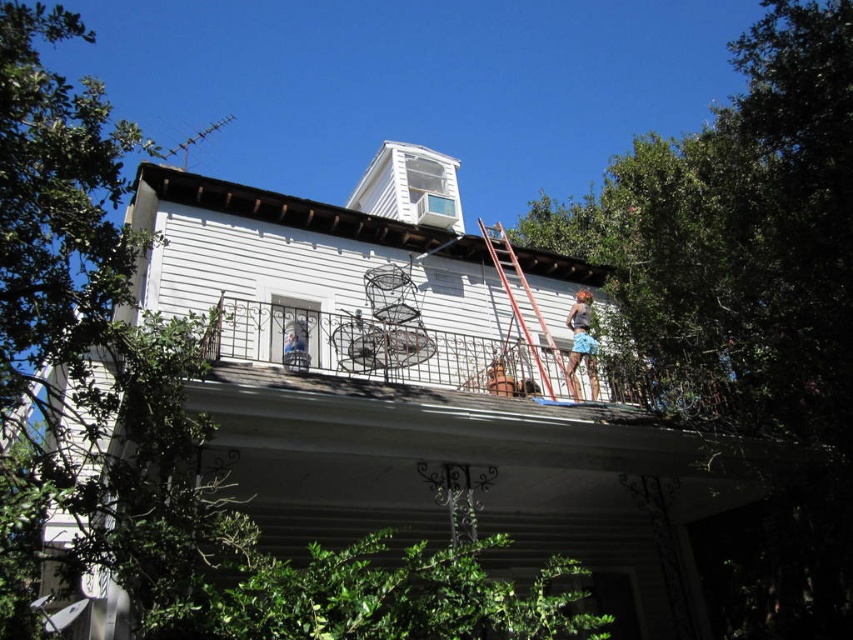
You are standing at the base of the rustic wood ladder at upper center, and you want to walk to the camera. How many steps would you need to take to reach the camera if each step covers 2.5 feet?

The distance between rustic wood ladder at upper center and the camera is 55.96 feet. Dividing this by 2.5 feet per step gives approximately 22.38 steps. Since you can only take whole steps, you would need to take 23 steps to reach the camera.

You are standing at the camera position and want to reach point (519, 308). Is the distance more than 60 feet?

The distance between point (519, 308) and the camera is 70.60 feet, which is more than 60 feet.